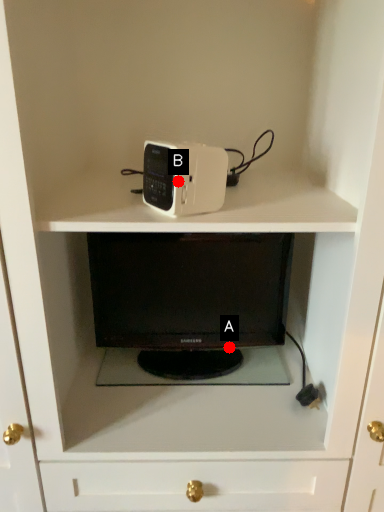
Question: Two points are circled on the image, labeled by A and B beside each circle. Which point is closer to the camera?

Choices:
 (A) A is closer
 (B) B is closer

Answer: (B)